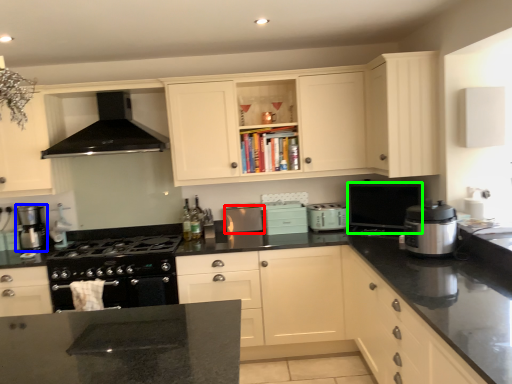
Question: Which is nearer to the kitchen appliance (highlighted by a red box)? kitchen appliance (highlighted by a blue box) or appliance (highlighted by a green box).

Choices:
 (A) kitchen appliance
 (B) appliance

Answer: (B)